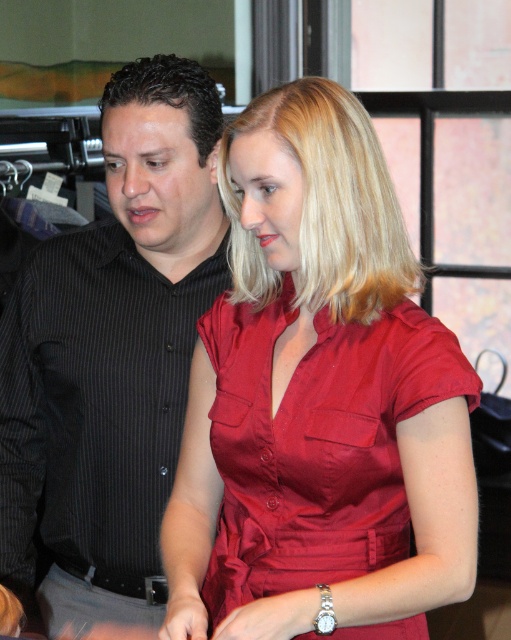
Does black striped shirt at center have a larger size compared to shiny red blouse at center?

Yes.

At what (x,y) coordinates should I click in order to perform the action: click on black striped shirt at center. Please return your answer as a coordinate pair (x, y). Looking at the image, I should click on [112, 355].